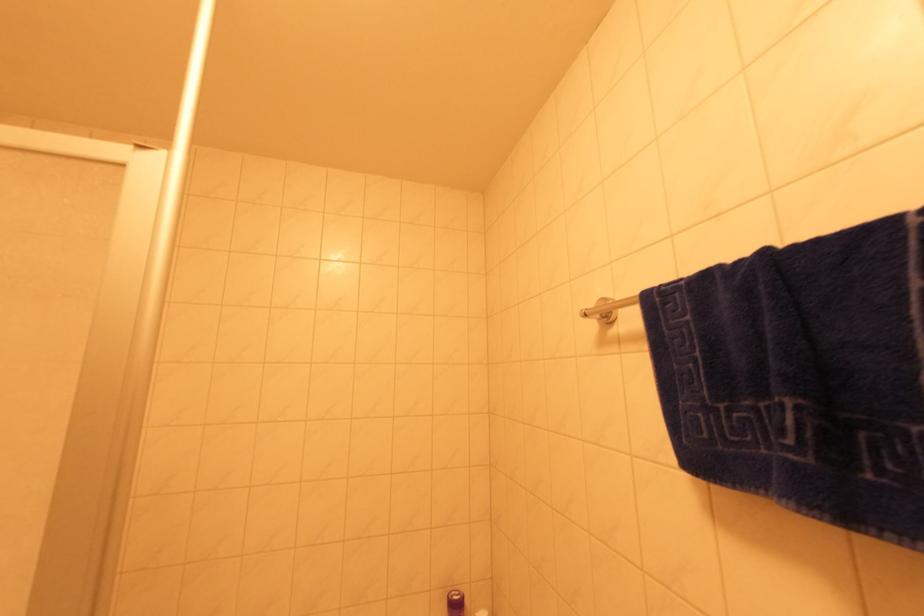
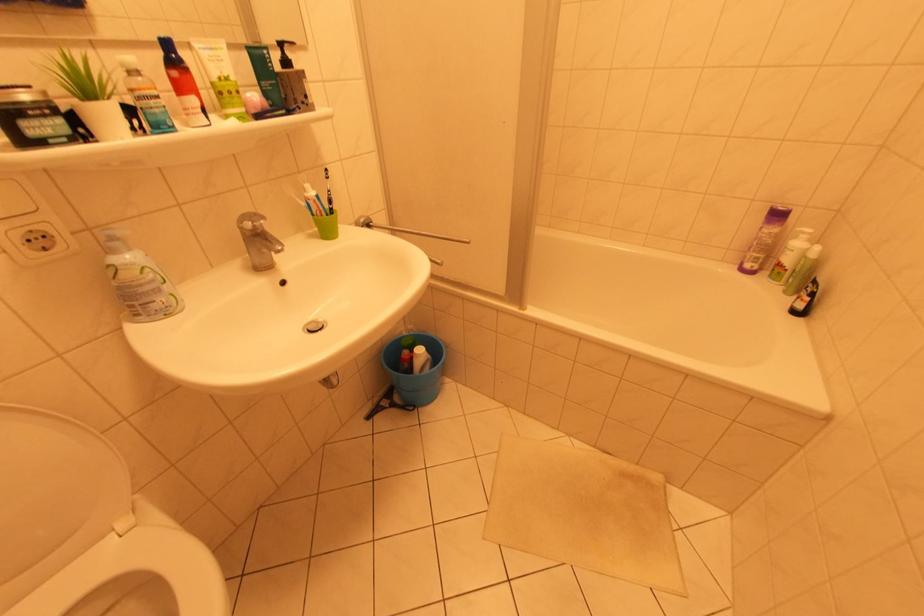
First-person continuous shooting, in which direction is the camera rotating?

The rotation direction of the camera is left-down.